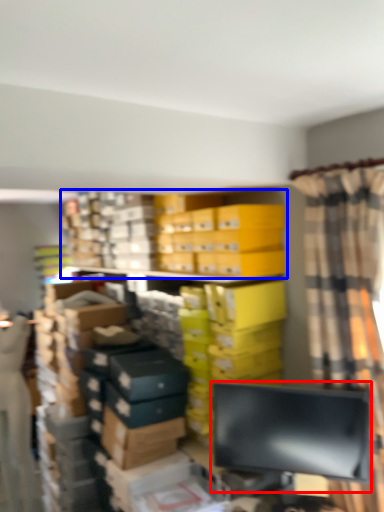
Question: Which object appears farthest to the camera in this image, computer monitor (highlighted by a red box) or bookcase (highlighted by a blue box)?

Choices:
 (A) computer monitor
 (B) bookcase

Answer: (B)